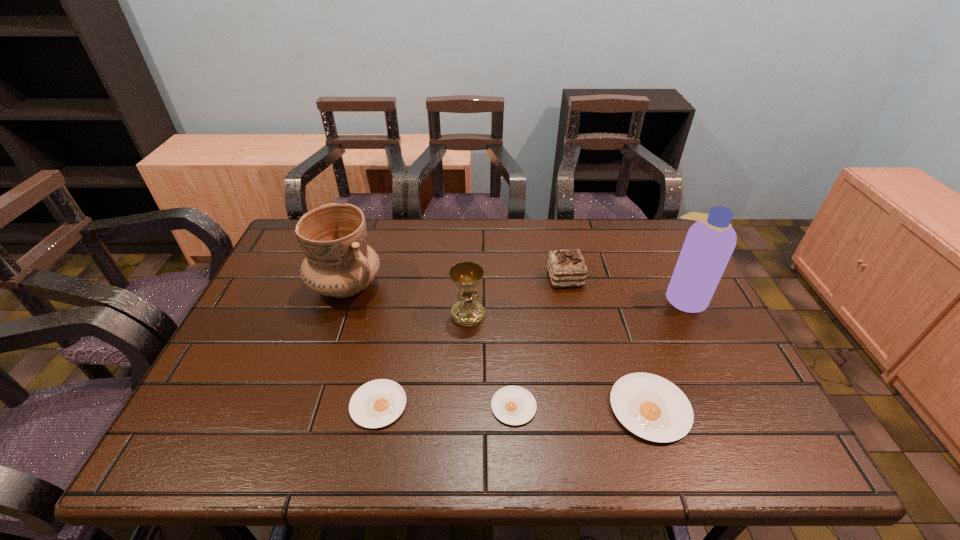
The width and height of the screenshot is (960, 540). What are the coordinates of `vacant space that is in between the second shortest egg yolk and the fifth shortest object` in the screenshot? It's located at (423, 359).

This screenshot has width=960, height=540. Identify the location of free space between the second tallest object and the chalice. (407, 300).

I want to click on free space between the shortest egg yolk and the leftmost egg yolk, so click(446, 406).

This screenshot has width=960, height=540. In order to click on unoccupied area between the third shortest object and the fifth object from right to left in this screenshot , I will do 559,361.

Find the location of a particular element. vacant area that lies between the shortest object and the fifth tallest object is located at coordinates (582, 407).

Locate an element on the screen. vacant space in between the tallest object and the fourth object from right to left is located at coordinates (599, 352).

Identify the location of the third closest object relative to the sixth shortest object. This screenshot has width=960, height=540. (513, 405).

You are a GUI agent. You are given a task and a screenshot of the screen. Output one action in this format:
    pyautogui.click(x=<x>, y=<y>)
    Task: Click on the object that can be found as the fifth closest to the third shortest object
    This screenshot has width=960, height=540.
    Given the screenshot: What is the action you would take?
    pyautogui.click(x=377, y=403)

Select which egg yolk is the second closest to the pottery. Please provide its 2D coordinates. Your answer should be formatted as a tuple, i.e. [(x, y)], where the tuple contains the x and y coordinates of a point satisfying the conditions above.

[(513, 405)]

Locate which egg yolk ranks in proximity to the shortest egg yolk. Please provide its 2D coordinates. Your answer should be formatted as a tuple, i.e. [(x, y)], where the tuple contains the x and y coordinates of a point satisfying the conditions above.

[(653, 408)]